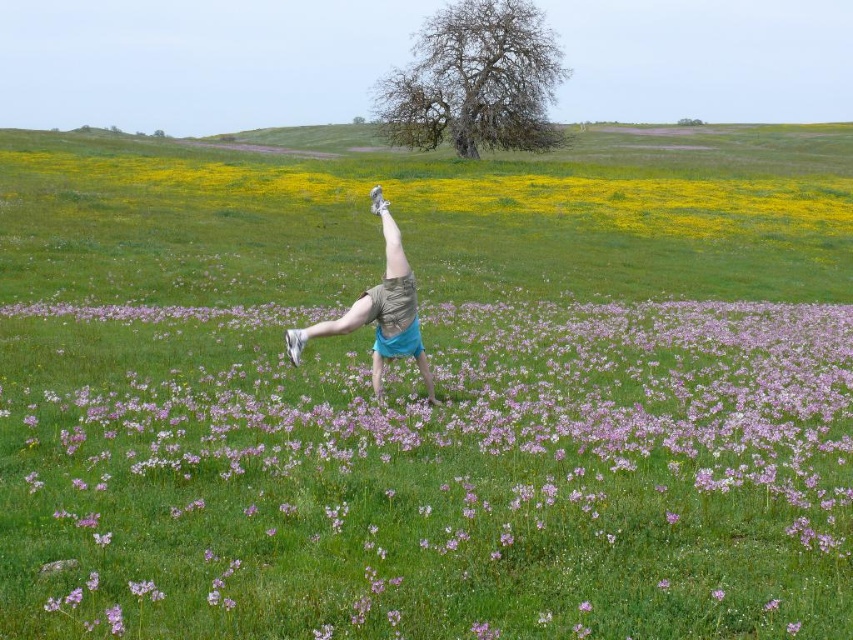
Is point (520, 202) farther from viewer compared to point (389, 253)?

Yes.

Is yellow matte flower at upper center further to the viewer compared to light blue shorts at center?

Yes, it is.

What do you see at coordinates (488, 193) in the screenshot? This screenshot has width=853, height=640. I see `yellow matte flower at upper center` at bounding box center [488, 193].

Find the location of `yellow matte flower at upper center`. yellow matte flower at upper center is located at coordinates (488, 193).

In the scene shown: Who is positioned more to the right, purple matte flower at center or light blue shorts at center?

Positioned to the right is purple matte flower at center.

The height and width of the screenshot is (640, 853). Describe the element at coordinates (430, 474) in the screenshot. I see `purple matte flower at center` at that location.

Between point (646, 484) and point (337, 320), which one is positioned behind?

The point (337, 320) is more distant.

At what (x,y) coordinates should I click in order to perform the action: click on purple matte flower at center. Please return your answer as a coordinate pair (x, y). Looking at the image, I should click on (430, 474).

Is purple matte flower at center to the left of yellow matte flower at upper center from the viewer's perspective?

In fact, purple matte flower at center is to the right of yellow matte flower at upper center.

Does purple matte flower at center have a smaller size compared to yellow matte flower at upper center?

Yes.

Does point (381, 404) lie in front of point (567, 198)?

That is True.

You are a GUI agent. You are given a task and a screenshot of the screen. Output one action in this format:
    pyautogui.click(x=<x>, y=<y>)
    Task: Click on the purple matte flower at center
    This screenshot has height=640, width=853.
    Given the screenshot: What is the action you would take?
    pyautogui.click(x=430, y=474)